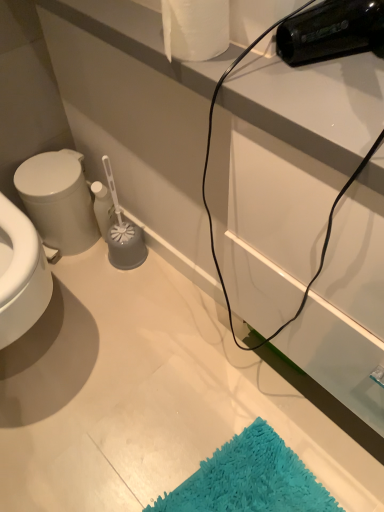
I want to click on vacant region above white glossy bidet at left (from a real-world perspective), so click(48, 172).